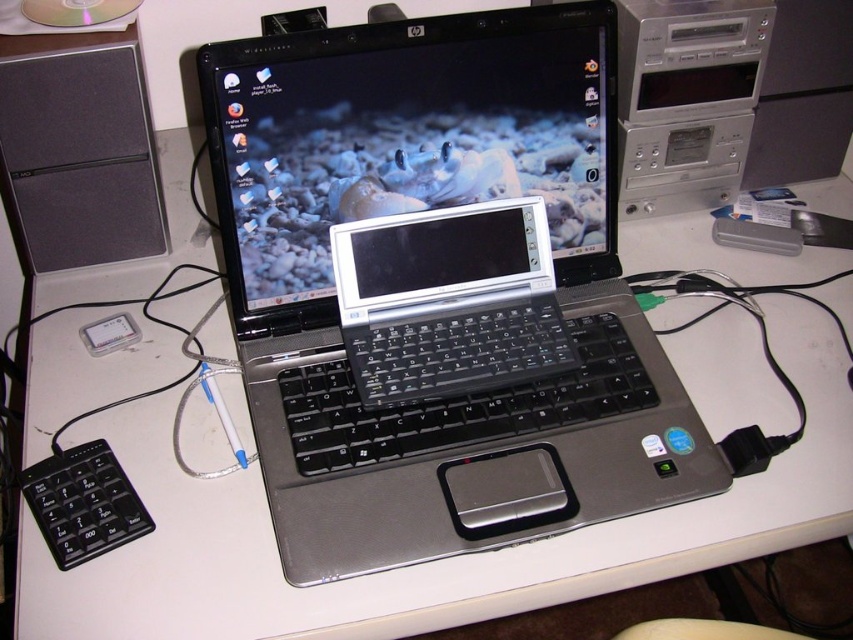
Is point (662, 404) in front of point (469, 276)?

Yes.

Based on the photo, who is higher up, silver/black laptop at center or silver metallic handheld device at center?

silver/black laptop at center

At what (x,y) coordinates should I click in order to perform the action: click on silver/black laptop at center. Please return your answer as a coordinate pair (x, y). Looking at the image, I should click on (424, 209).

Identify the location of silver/black laptop at center. This screenshot has width=853, height=640. (424, 209).

Who is higher up, silver/black plastic laptop at center or silver metallic handheld device at center?

silver/black plastic laptop at center is above.

Does point (293, 236) come behind point (450, 240)?

No.

Which is behind, point (583, 61) or point (509, 310)?

Positioned behind is point (509, 310).

I want to click on silver/black plastic laptop at center, so click(405, 141).

In the scene shown: Between silver/black plastic laptop at center and black matte speaker at upper left, which one appears on the right side from the viewer's perspective?

From the viewer's perspective, silver/black plastic laptop at center appears more on the right side.

Who is shorter, silver/black plastic laptop at center or black matte speaker at upper left?

black matte speaker at upper left is shorter.

Locate an element on the screen. This screenshot has height=640, width=853. silver/black plastic laptop at center is located at coordinates (405, 141).

What are the coordinates of `silver/black plastic laptop at center` in the screenshot? It's located at (405, 141).